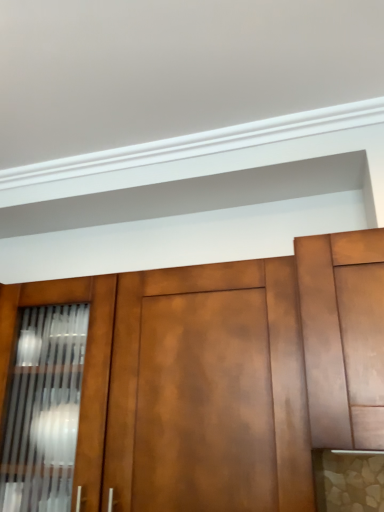
Question: From a real-world perspective, does matte wood cabinet at center, which is counted as the first cabinetry, starting from the left, stand above matte brown cabinet at right, arranged as the 2th cabinetry when viewed from the left?

Choices:
 (A) yes
 (B) no

Answer: (B)

Question: Is matte wood cabinet at center, which is counted as the first cabinetry, starting from the left, next to matte brown cabinet at right, marked as the first cabinetry in a right-to-left arrangement, and touching it?

Choices:
 (A) no
 (B) yes

Answer: (A)

Question: Is matte wood cabinet at center, which is counted as the first cabinetry, starting from the left, smaller than matte brown cabinet at right, arranged as the 2th cabinetry when viewed from the left?

Choices:
 (A) no
 (B) yes

Answer: (A)

Question: Considering the relative positions of matte wood cabinet at center, which is counted as the first cabinetry, starting from the left, and matte brown cabinet at right, marked as the first cabinetry in a right-to-left arrangement, in the image provided, is matte wood cabinet at center, which is counted as the first cabinetry, starting from the left, to the right of matte brown cabinet at right, marked as the first cabinetry in a right-to-left arrangement, from the viewer's perspective?

Choices:
 (A) yes
 (B) no

Answer: (B)

Question: Does matte wood cabinet at center, which ranks as the second cabinetry in right-to-left order, have a greater width compared to matte brown cabinet at right, arranged as the 2th cabinetry when viewed from the left?

Choices:
 (A) no
 (B) yes

Answer: (A)

Question: Can you confirm if matte wood cabinet at center, which is counted as the first cabinetry, starting from the left, is positioned to the left of matte brown cabinet at right, arranged as the 2th cabinetry when viewed from the left?

Choices:
 (A) no
 (B) yes

Answer: (B)

Question: From the image's perspective, would you say matte brown cabinet at right, marked as the first cabinetry in a right-to-left arrangement, is shown under matte wood cabinet at center, which is counted as the first cabinetry, starting from the left?

Choices:
 (A) yes
 (B) no

Answer: (B)

Question: Does matte brown cabinet at right, marked as the first cabinetry in a right-to-left arrangement, have a smaller size compared to matte wood cabinet at center, which is counted as the first cabinetry, starting from the left?

Choices:
 (A) yes
 (B) no

Answer: (A)

Question: Is matte brown cabinet at right, marked as the first cabinetry in a right-to-left arrangement, oriented away from matte wood cabinet at center, which is counted as the first cabinetry, starting from the left?

Choices:
 (A) no
 (B) yes

Answer: (A)

Question: Does matte brown cabinet at right, arranged as the 2th cabinetry when viewed from the left, have a greater height compared to matte wood cabinet at center, which ranks as the second cabinetry in right-to-left order?

Choices:
 (A) yes
 (B) no

Answer: (B)

Question: Is matte brown cabinet at right, marked as the first cabinetry in a right-to-left arrangement, not close to matte wood cabinet at center, which ranks as the second cabinetry in right-to-left order?

Choices:
 (A) no
 (B) yes

Answer: (A)

Question: Does matte brown cabinet at right, arranged as the 2th cabinetry when viewed from the left, come in front of matte wood cabinet at center, which is counted as the first cabinetry, starting from the left?

Choices:
 (A) yes
 (B) no

Answer: (A)

Question: Does point (312, 386) appear closer or farther from the camera than point (326, 328)?

Choices:
 (A) farther
 (B) closer

Answer: (B)